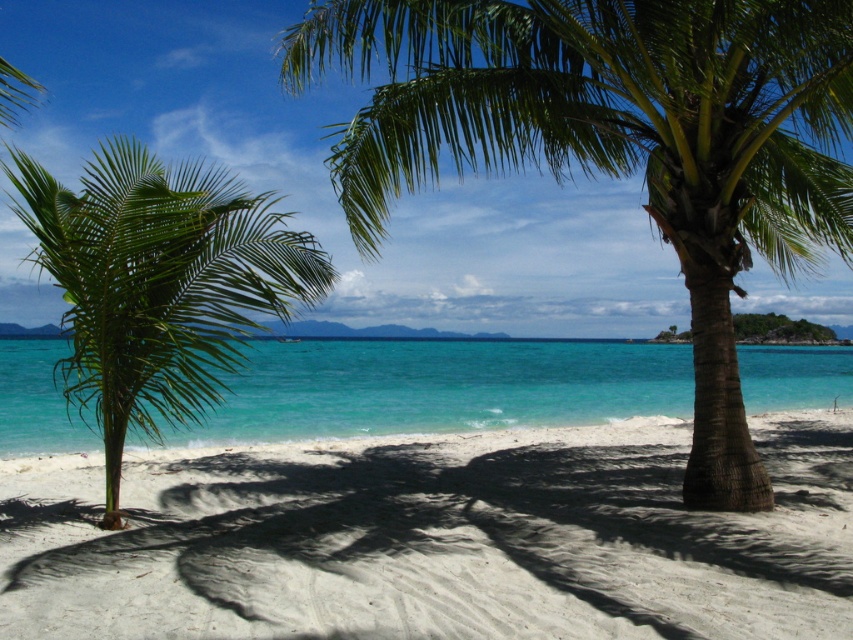
Looking at this image, who is taller, white sandy beach at center or green leafy palm tree at left?

Standing taller between the two is green leafy palm tree at left.

Between white sandy beach at center and green leafy palm tree at left, which one is positioned lower?

white sandy beach at center is lower down.

Who is more distant from viewer, (387, 476) or (172, 320)?

Positioned behind is point (387, 476).

This screenshot has height=640, width=853. In order to click on white sandy beach at center in this screenshot , I will do `click(434, 538)`.

Between white sandy beach at center and turquoise glossy water at center, which one has more height?

Standing taller between the two is turquoise glossy water at center.

Based on the photo, does white sandy beach at center appear over turquoise glossy water at center?

No.

This screenshot has width=853, height=640. Find the location of `white sandy beach at center`. white sandy beach at center is located at coordinates (434, 538).

Locate an element on the screen. The height and width of the screenshot is (640, 853). white sandy beach at center is located at coordinates [x=434, y=538].

Between green leafy palm tree at center and green leafy palm tree at left, which one is positioned higher?

green leafy palm tree at center is above.

Image resolution: width=853 pixels, height=640 pixels. I want to click on green leafy palm tree at center, so click(618, 141).

Where is `green leafy palm tree at center`? This screenshot has height=640, width=853. green leafy palm tree at center is located at coordinates pos(618,141).